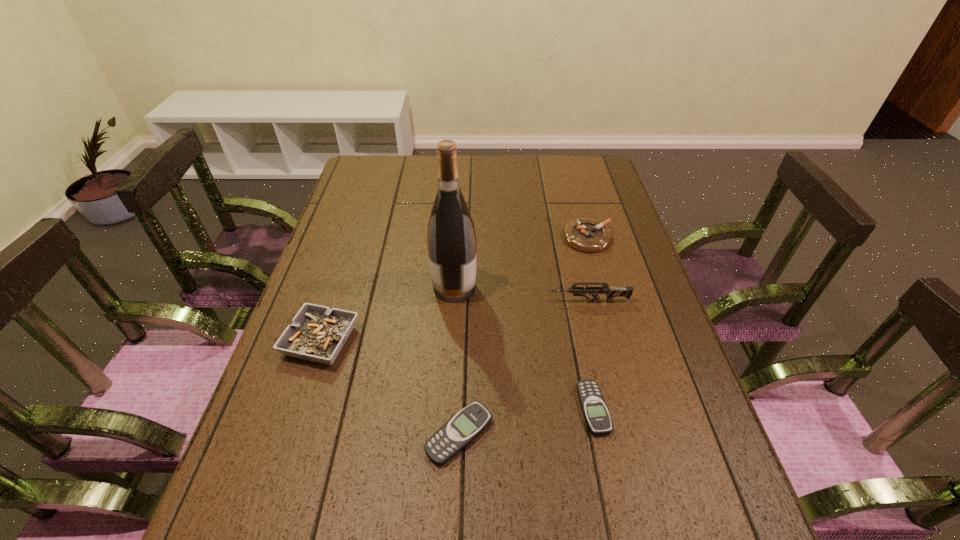
Where is `unoccupied position between the wine bottle and the second tallest object`? Image resolution: width=960 pixels, height=540 pixels. unoccupied position between the wine bottle and the second tallest object is located at coordinates (521, 294).

The image size is (960, 540). Identify the location of blank region between the wine bottle and the farthest object. (521, 263).

Find the location of a particular element. The image size is (960, 540). vacant space that is in between the shorter beeper and the taller beeper is located at coordinates (526, 422).

This screenshot has height=540, width=960. In order to click on unoccupied area between the farthest object and the tallest object in this screenshot , I will do `click(521, 263)`.

Image resolution: width=960 pixels, height=540 pixels. What are the coordinates of `vacant space that is in between the wine bottle and the leftmost object` in the screenshot? It's located at (388, 314).

The height and width of the screenshot is (540, 960). Identify the location of free area in between the gun and the right beeper. (590, 355).

Where is `vacant area that lies between the nearer ashtray and the fifth tallest object`? This screenshot has width=960, height=540. vacant area that lies between the nearer ashtray and the fifth tallest object is located at coordinates (390, 388).

Where is `object that is the fifth closest to the left ashtray`? Image resolution: width=960 pixels, height=540 pixels. object that is the fifth closest to the left ashtray is located at coordinates (588, 235).

This screenshot has height=540, width=960. Find the location of `object that stands as the second closest to the fifth shortest object`. object that stands as the second closest to the fifth shortest object is located at coordinates (451, 238).

The height and width of the screenshot is (540, 960). I want to click on free location that satisfies the following two spatial constraints: 1. on the label of the tallest object; 2. on the right side of the second shortest object, so click(445, 435).